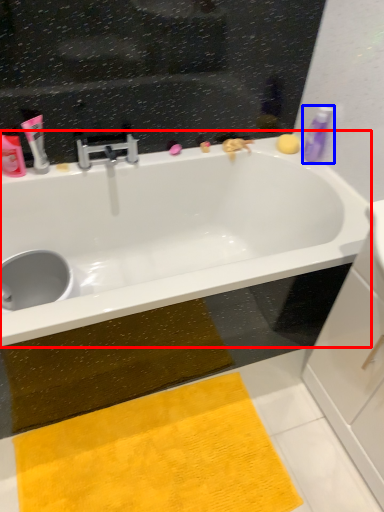
Question: Which object appears closest to the camera in this image, bathtub (highlighted by a red box) or toiletry (highlighted by a blue box)?

Choices:
 (A) bathtub
 (B) toiletry

Answer: (A)